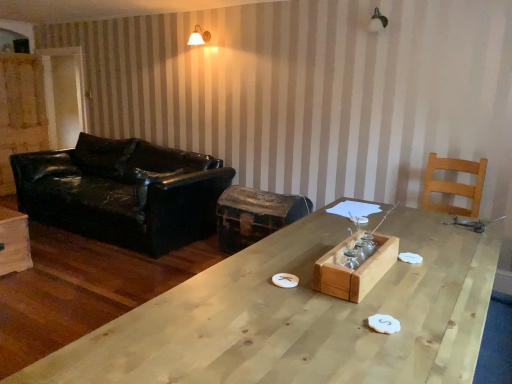
Question: Considering the relative positions of rusty metal trunk at center and natural wood table at center in the image provided, is rusty metal trunk at center to the right of natural wood table at center from the viewer's perspective?

Choices:
 (A) yes
 (B) no

Answer: (B)

Question: From a real-world perspective, is rusty metal trunk at center physically above natural wood table at center?

Choices:
 (A) no
 (B) yes

Answer: (A)

Question: Is rusty metal trunk at center smaller than natural wood table at center?

Choices:
 (A) no
 (B) yes

Answer: (B)

Question: Does rusty metal trunk at center have a greater height compared to natural wood table at center?

Choices:
 (A) no
 (B) yes

Answer: (A)

Question: Considering the relative sizes of rusty metal trunk at center and natural wood table at center in the image provided, is rusty metal trunk at center bigger than natural wood table at center?

Choices:
 (A) no
 (B) yes

Answer: (A)

Question: In the image, is white matte wall sconce at upper center on the left side or the right side of black leather couch at left?

Choices:
 (A) left
 (B) right

Answer: (B)

Question: Which is correct: white matte wall sconce at upper center is inside black leather couch at left, or outside of it?

Choices:
 (A) outside
 (B) inside

Answer: (A)

Question: From a real-world perspective, is white matte wall sconce at upper center physically located above or below black leather couch at left?

Choices:
 (A) above
 (B) below

Answer: (A)

Question: Does point (x=198, y=34) appear closer or farther from the camera than point (x=112, y=225)?

Choices:
 (A) closer
 (B) farther

Answer: (B)

Question: Looking at the image, does light brown wooden chair at right seem bigger or smaller compared to black leather couch at left?

Choices:
 (A) big
 (B) small

Answer: (B)

Question: Considering the positions of point 453,190 and point 98,226, is point 453,190 closer or farther from the camera than point 98,226?

Choices:
 (A) closer
 (B) farther

Answer: (A)

Question: From a real-world perspective, is light brown wooden chair at right above or below black leather couch at left?

Choices:
 (A) above
 (B) below

Answer: (A)

Question: Is light brown wooden chair at right inside or outside of black leather couch at left?

Choices:
 (A) inside
 (B) outside

Answer: (B)

Question: From a real-world perspective, is natural wood table at center physically located above or below light brown wooden chair at right?

Choices:
 (A) above
 (B) below

Answer: (B)

Question: Visually, is natural wood table at center positioned to the left or to the right of light brown wooden chair at right?

Choices:
 (A) right
 (B) left

Answer: (B)